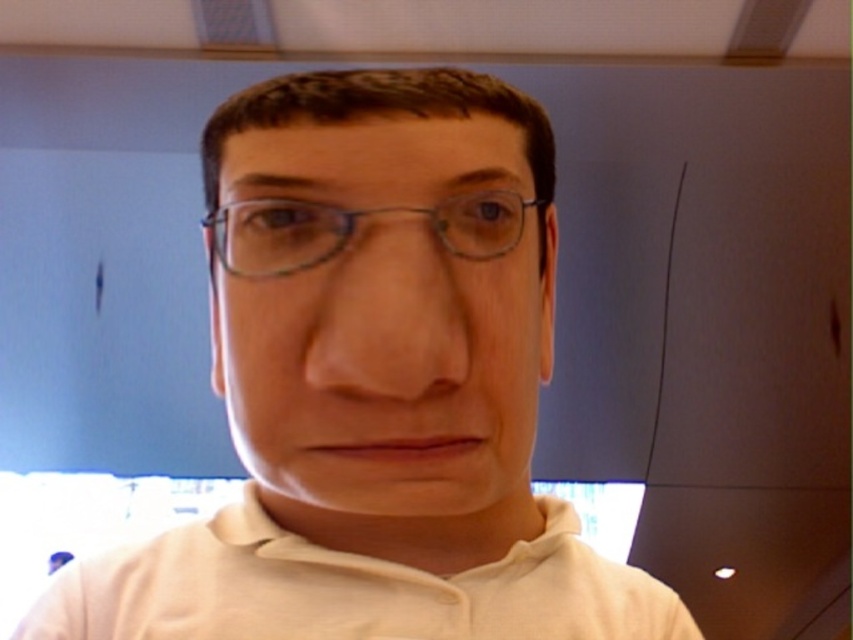
In the scene shown: You are a photographer adjusting the lighting in a studio. You notice the matte plastic face at center and the clear plastic glasses at center in your frame. Which object is positioned lower in the image?

The matte plastic face at center is positioned below the clear plastic glasses at center, so the matte plastic face at center is lower in the image.

Based on the scene description, where is the matte plastic face at center located in terms of coordinates?

The matte plastic face at center is located at coordinates point (389, 371).

Consider the image. You are an interior designer analyzing the lighting in this indoor space. You notice a matte plastic face at center located at point (389, 371). Based on the scene description, can you determine if this object is illuminated by natural light coming through the window or glass panel at the bottom of the frame?

The matte plastic face at center located at point (389, 371) is illuminated by both natural light from the window or glass panel at the bottom and the ambient indoor lighting sources like the recessed ceiling lights, as the scene describes soft and even overall lighting with natural light entering through the window.